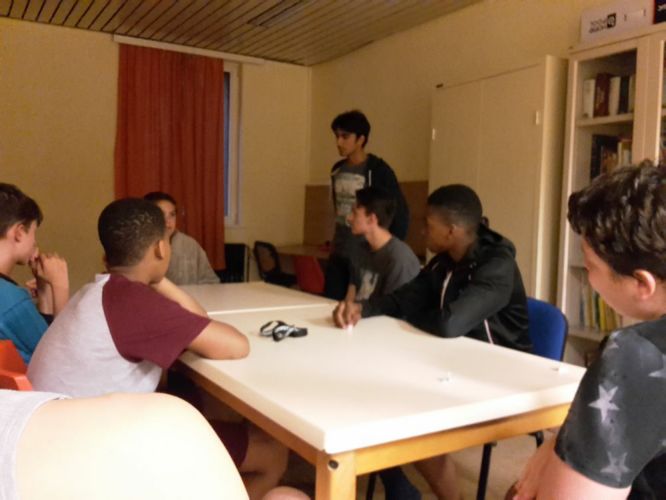
Locate an element on the screen. Image resolution: width=666 pixels, height=500 pixels. metal leg is located at coordinates (479, 467).